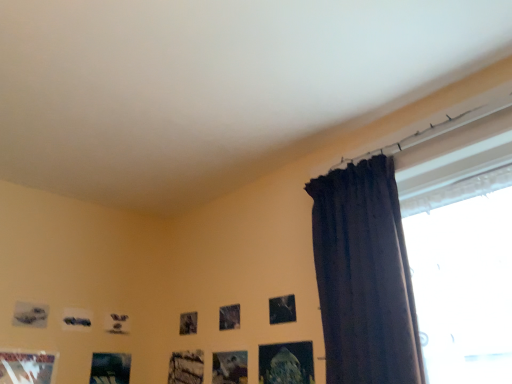
Question: Considering the positions of metallic silver picture frame at upper center, which appears as the 2th picture frame when viewed from the right, and matte gray picture frame at lower left, arranged as the 7th picture frame when viewed from the right, in the image, is metallic silver picture frame at upper center, which appears as the 2th picture frame when viewed from the right, bigger or smaller than matte gray picture frame at lower left, arranged as the 7th picture frame when viewed from the right,?

Choices:
 (A) big
 (B) small

Answer: (B)

Question: From their relative heights in the image, would you say metallic silver picture frame at upper center, which appears as the 2th picture frame when viewed from the right, is taller or shorter than matte gray picture frame at lower left, arranged as the 7th picture frame when viewed from the right?

Choices:
 (A) tall
 (B) short

Answer: (A)

Question: Which object is the farthest from the wooden frame at lower center, arranged as the fourth picture frame when viewed from the right?

Choices:
 (A) matte gray picture frame at lower left, arranged as the 7th picture frame when viewed from the right
 (B) metallic silver picture frame at upper center, which appears as the 2th picture frame when viewed from the right
 (C) metallic glass picture frame at lower center, the 1th picture frame viewed from the right
 (D) metallic silver picture frame at lower center, the third picture frame in the right-to-left sequence
 (E) matte black picture frame at lower left, arranged as the 3th picture frame when viewed from the left

Answer: (A)

Question: Which object is positioned closest to the matte gray picture frame at lower left, the first picture frame in the left-to-right sequence?

Choices:
 (A) wooden frame at lower center, arranged as the fourth picture frame when viewed from the right
 (B) metallic silver picture frame at lower left, the 6th picture frame in the right-to-left sequence
 (C) dark fabric curtain at right
 (D) metallic silver picture frame at lower center, the 5th picture frame when ordered from left to right
 (E) metallic glass picture frame at lower center, the 1th picture frame viewed from the right

Answer: (B)